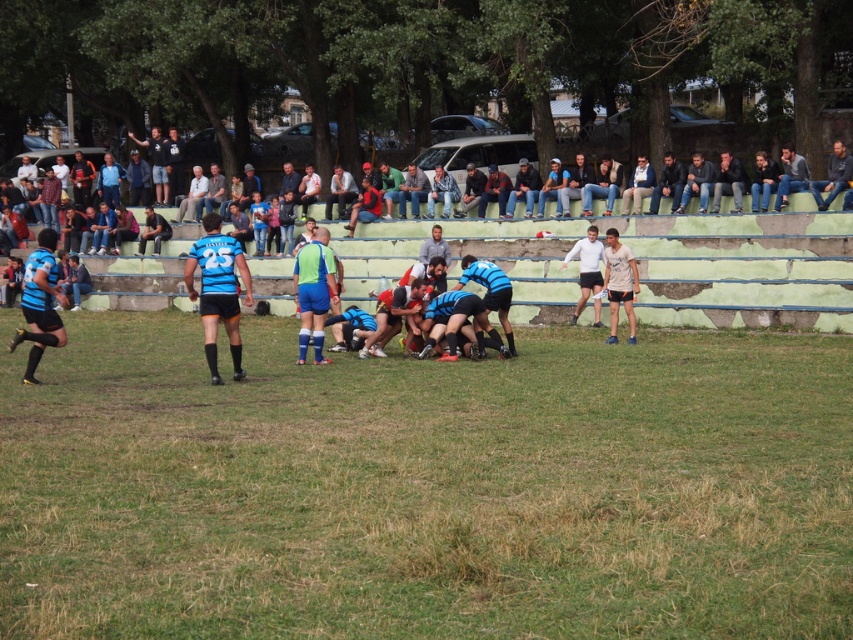
Question: Which point is farther from the camera taking this photo?

Choices:
 (A) (318, 326)
 (B) (230, 248)
 (C) (579, 289)
 (D) (766, 202)

Answer: (D)

Question: Considering the real-world distances, which object is farthest from the light brown fabric shirt at center?

Choices:
 (A) jeans at upper right
 (B) blue matte rugby ball at center
 (C) matte blue jersey at left

Answer: (C)

Question: Which of these objects is positioned closest to the light brown fabric shirt at center?

Choices:
 (A) jeans at upper right
 (B) green grass at center

Answer: (B)

Question: Observing the image, what is the correct spatial positioning of light brown fabric shirt at center in reference to blue matte rugby ball at center?

Choices:
 (A) above
 (B) below

Answer: (A)

Question: Is matte blue jersey at left closer to the viewer compared to blue fabric rugby player at center?

Choices:
 (A) no
 (B) yes

Answer: (B)

Question: Does blue fabric rugby player at center appear over light brown fabric shirt at center?

Choices:
 (A) no
 (B) yes

Answer: (A)